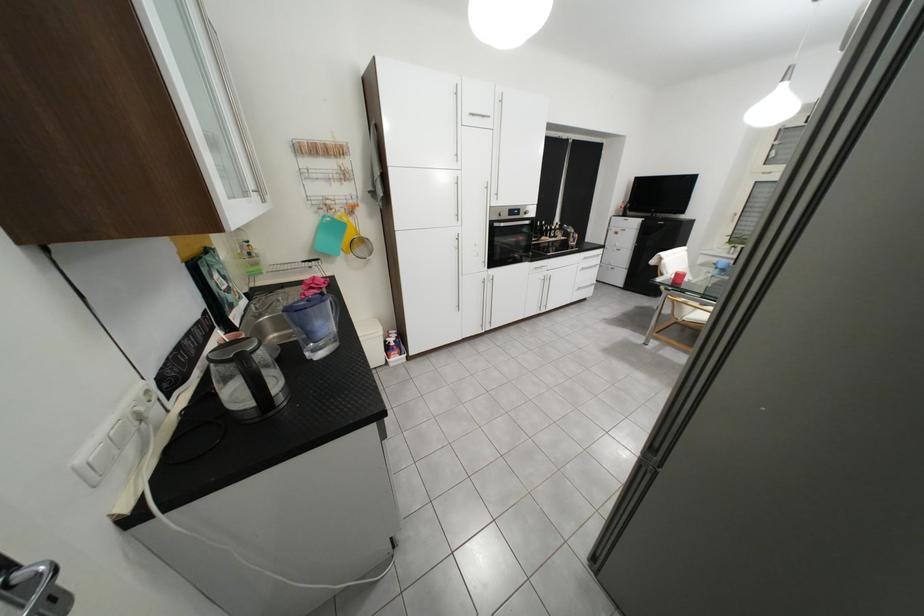
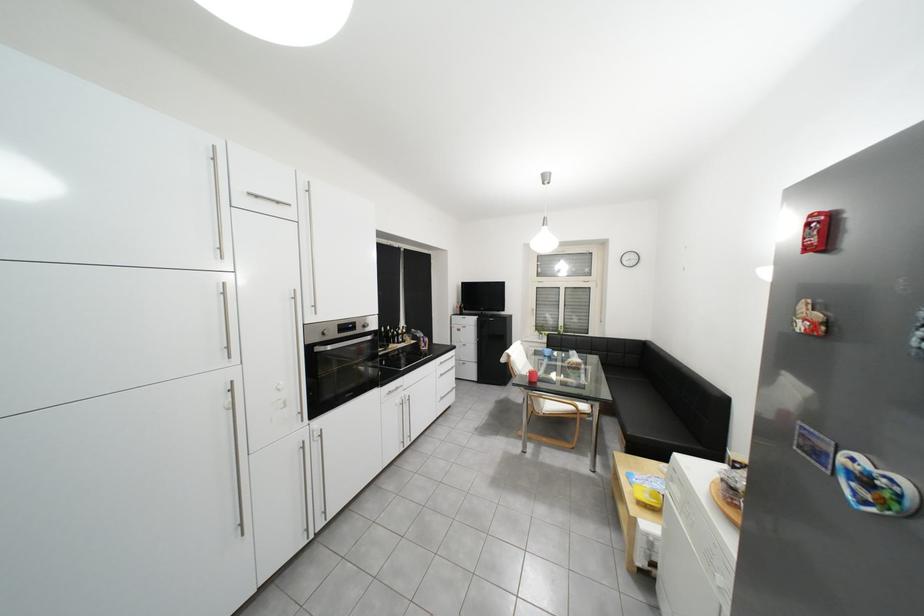
How did the camera likely rotate?

The rotation direction of the camera is right-up.